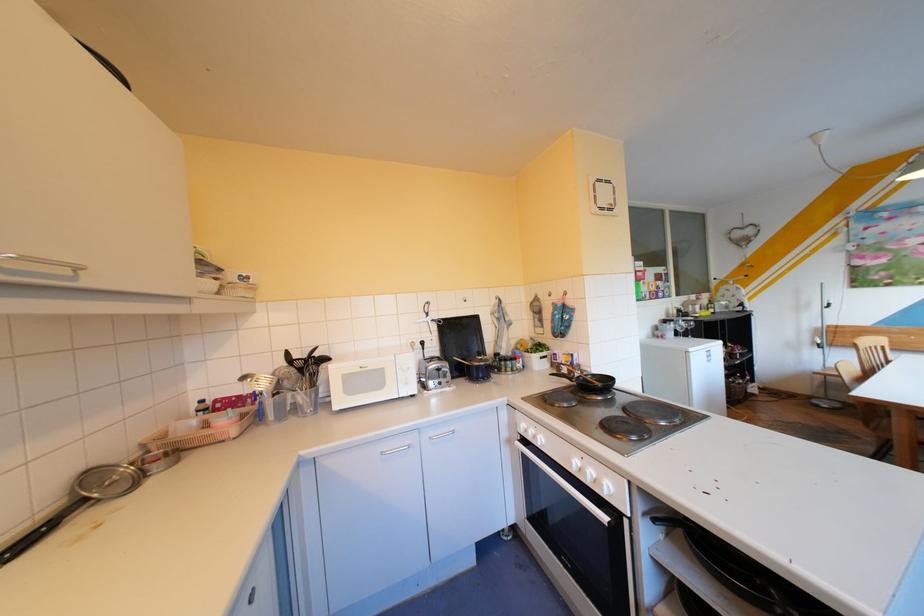
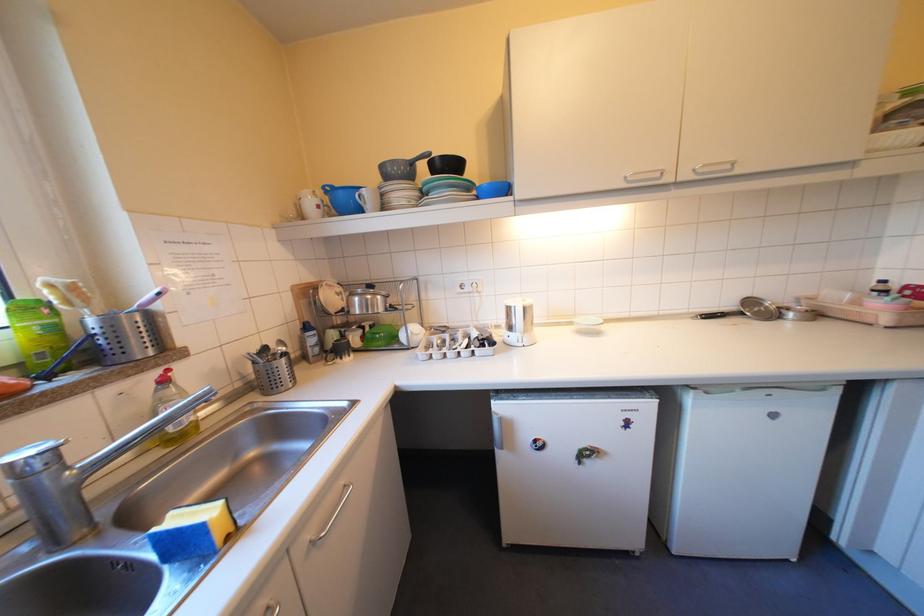
First-person continuous shooting, in which direction is the camera rotating?

The rotation direction of the camera is left-down.